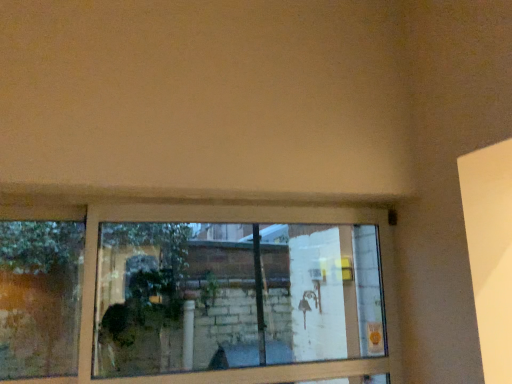
What is the approximate height of clear glass window at center?

Answer: 29.97 inches.

Describe the element at coordinates (239, 221) in the screenshot. I see `clear glass window at center` at that location.

Locate an element on the screen. clear glass window at center is located at coordinates (239, 221).

Image resolution: width=512 pixels, height=384 pixels. Identify the location of clear glass window at center. (239, 221).